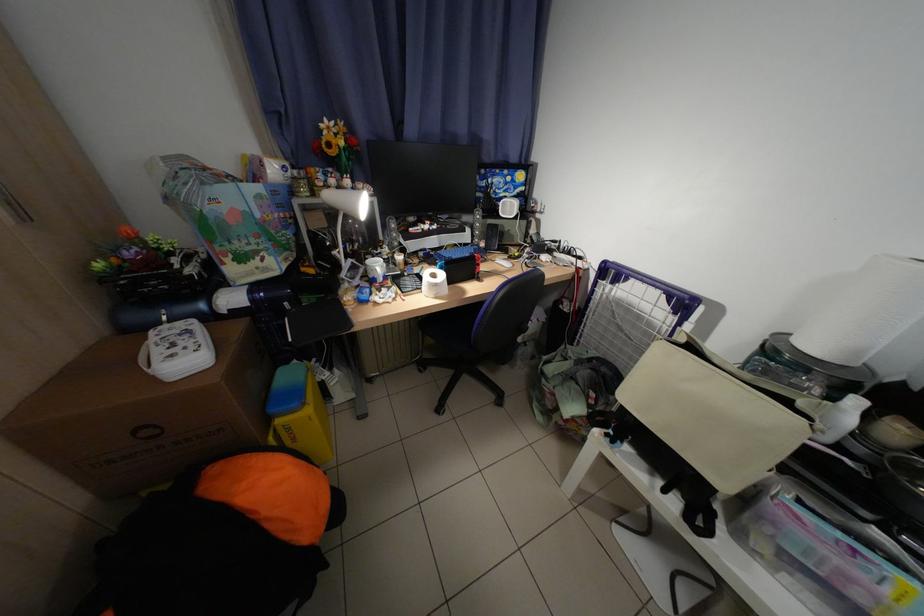
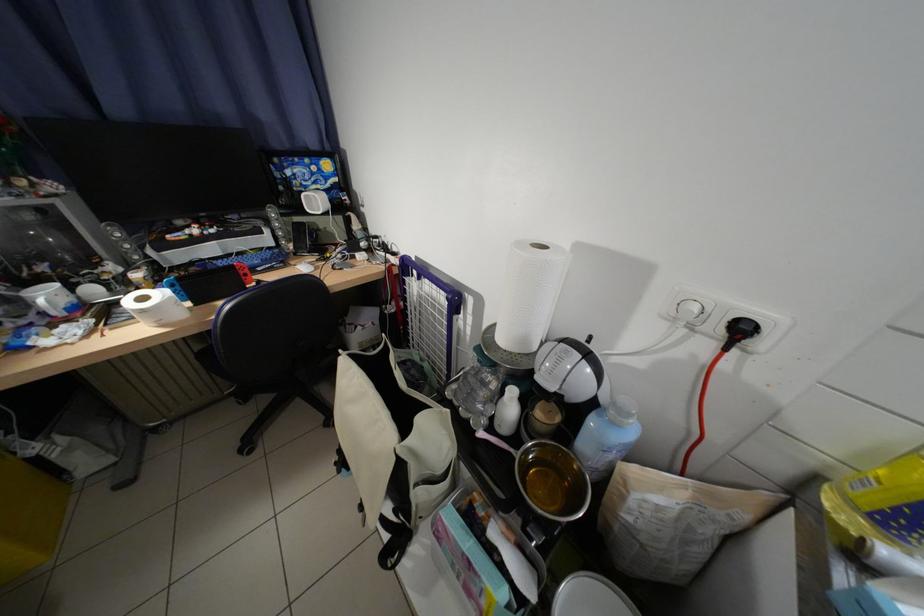
Question: Based on the continuous images, in which direction is the camera rotating? Reply with the corresponding letter.

Choices:
 (A) Left
 (B) Right
 (C) Up
 (D) Down

Answer: (B)